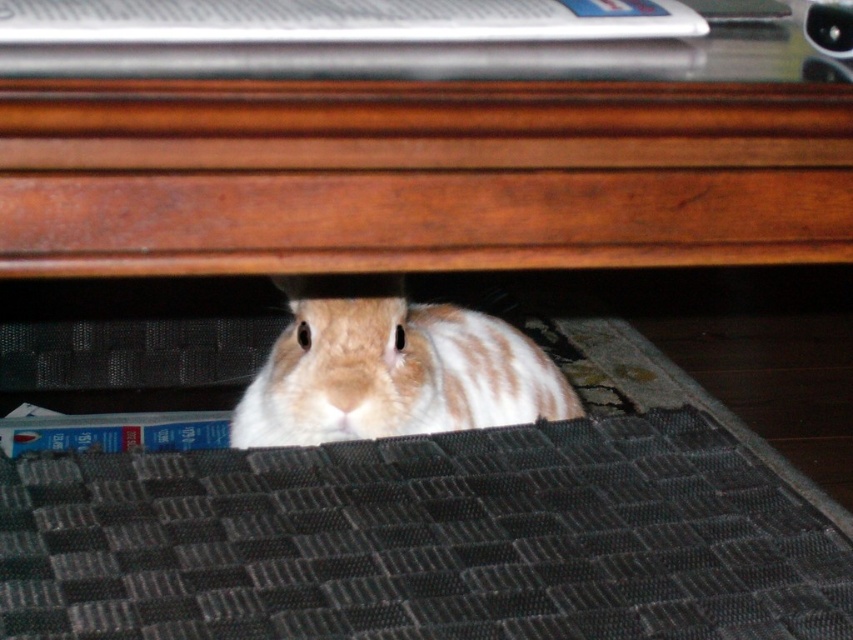
Question: Considering the real-world distances, which object is closest to the brown wood table at center?

Choices:
 (A) brown and white fur rabbit under the desk
 (B) black textured mat at lower center

Answer: (B)

Question: From the image, what is the correct spatial relationship of brown wood table at center in relation to brown and white fur rabbit under the desk?

Choices:
 (A) right
 (B) left

Answer: (A)

Question: Can you confirm if black textured mat at lower center is positioned to the right of brown and white fur rabbit under the desk?

Choices:
 (A) yes
 (B) no

Answer: (A)

Question: Can you confirm if brown wood table at center is smaller than brown and white fur rabbit under the desk?

Choices:
 (A) no
 (B) yes

Answer: (A)

Question: Which object is closer to the camera taking this photo?

Choices:
 (A) brown wood table at center
 (B) black textured mat at lower center
 (C) brown and white fur rabbit under the desk

Answer: (A)

Question: Which of the following is the farthest from the observer?

Choices:
 (A) brown wood table at center
 (B) brown and white fur rabbit under the desk

Answer: (B)